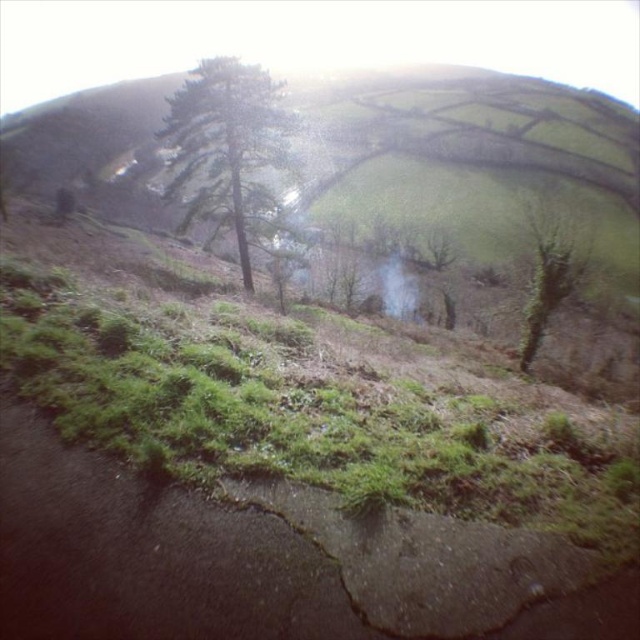
Question: Where is green grassy hillside at center located in relation to green rough bark tree at right in the image?

Choices:
 (A) left
 (B) right

Answer: (A)

Question: Does green matte tree at upper center have a lesser width compared to green rough bark tree at right?

Choices:
 (A) yes
 (B) no

Answer: (B)

Question: Which object is farther from the camera taking this photo?

Choices:
 (A) green matte tree at upper center
 (B) green grassy hillside at center
 (C) green rough bark tree at right

Answer: (B)

Question: Estimate the real-world distances between objects in this image. Which object is farther from the green matte tree at upper center?

Choices:
 (A) green grassy hillside at center
 (B) green rough bark tree at right

Answer: (A)

Question: Which object is the farthest from the green rough bark tree at right?

Choices:
 (A) green grassy hillside at center
 (B) green matte tree at upper center

Answer: (A)

Question: Is green grassy hillside at center behind green matte tree at upper center?

Choices:
 (A) no
 (B) yes

Answer: (B)